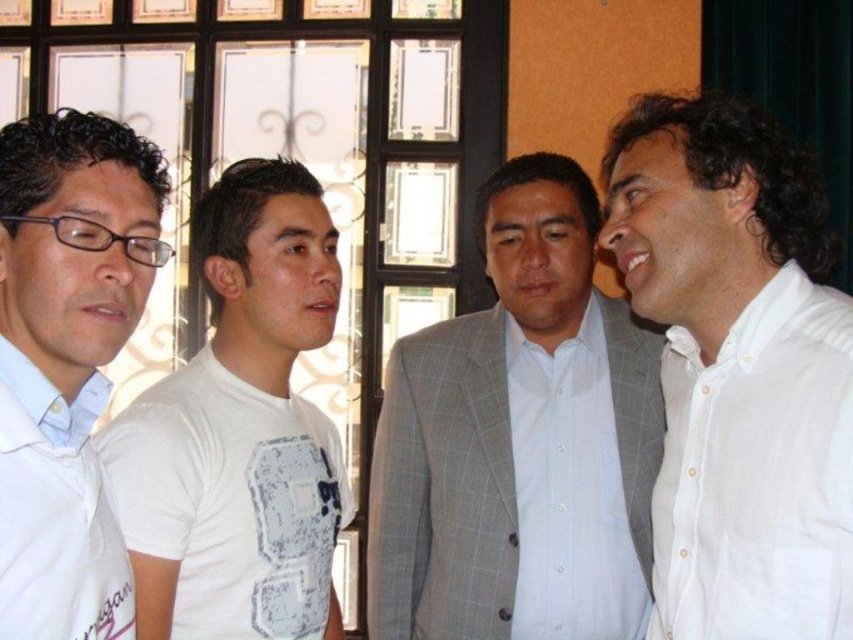
Does white cotton shirt at right have a smaller size compared to light gray checkered suit at center?

Actually, white cotton shirt at right might be larger than light gray checkered suit at center.

Who is higher up, white cotton shirt at right or light gray checkered suit at center?

white cotton shirt at right is above.

The width and height of the screenshot is (853, 640). I want to click on white cotton shirt at right, so click(738, 369).

At what (x,y) coordinates should I click in order to perform the action: click on white cotton shirt at right. Please return your answer as a coordinate pair (x, y). This screenshot has height=640, width=853. Looking at the image, I should click on (738, 369).

Does light gray checkered suit at center have a smaller size compared to white shirt at left?

No, light gray checkered suit at center is not smaller than white shirt at left.

Which of these two, light gray checkered suit at center or white shirt at left, stands shorter?

Standing shorter between the two is white shirt at left.

Who is more distant from viewer, (514, 307) or (74, 547)?

Point (514, 307)

Image resolution: width=853 pixels, height=640 pixels. In order to click on light gray checkered suit at center in this screenshot , I will do `click(519, 440)`.

How far apart are white cotton t-shirt at left and white shirt at left?

27.84 inches

Which is behind, point (276, 300) or point (67, 637)?

Point (276, 300)

Which is in front, point (258, 484) or point (126, 628)?

Positioned in front is point (126, 628).

Identify the location of white cotton t-shirt at left. (241, 429).